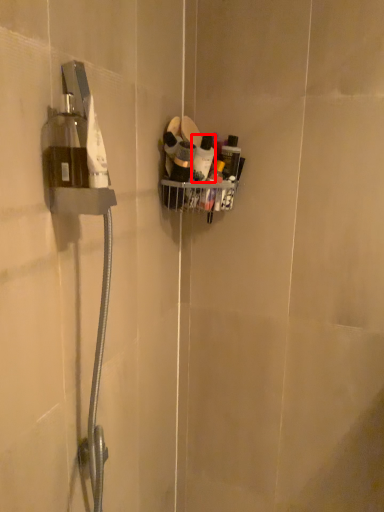
Question: From the image's perspective, considering the relative positions of toiletry (annotated by the red box) and toiletry in the image provided, where is toiletry (annotated by the red box) located with respect to the staircase?

Choices:
 (A) above
 (B) below

Answer: (B)